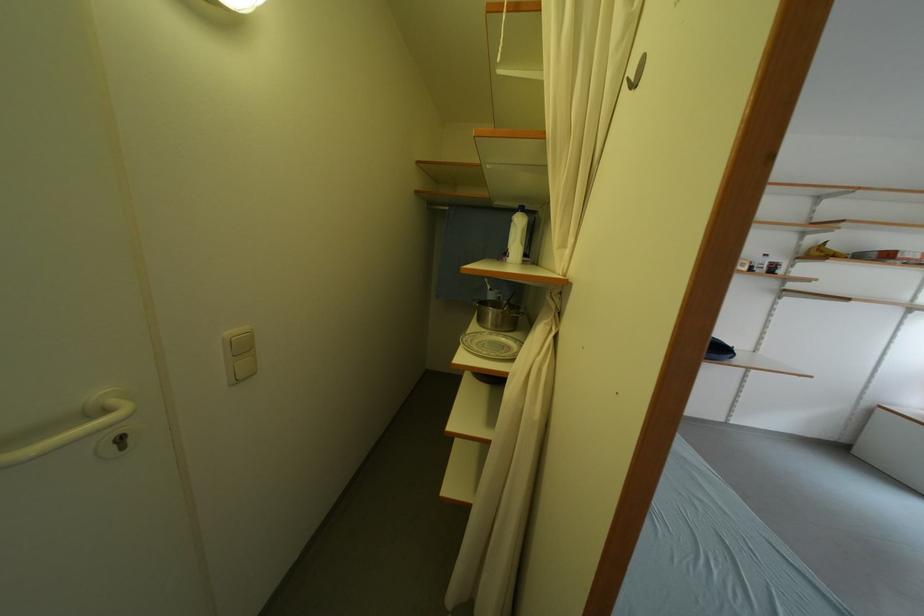
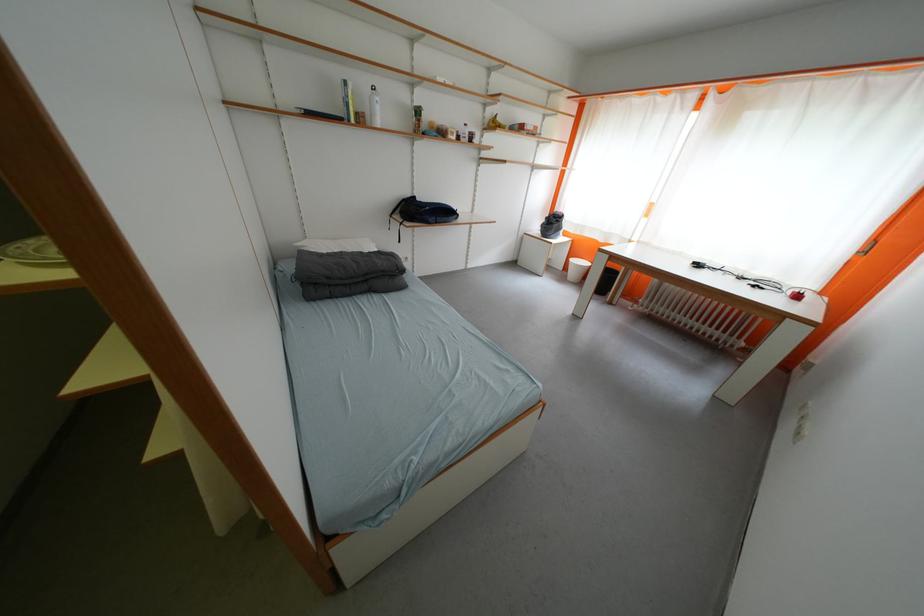
The first image is from the beginning of the video and the second image is from the end. How did the camera likely rotate when shooting the video?

The camera rotated toward right-down.